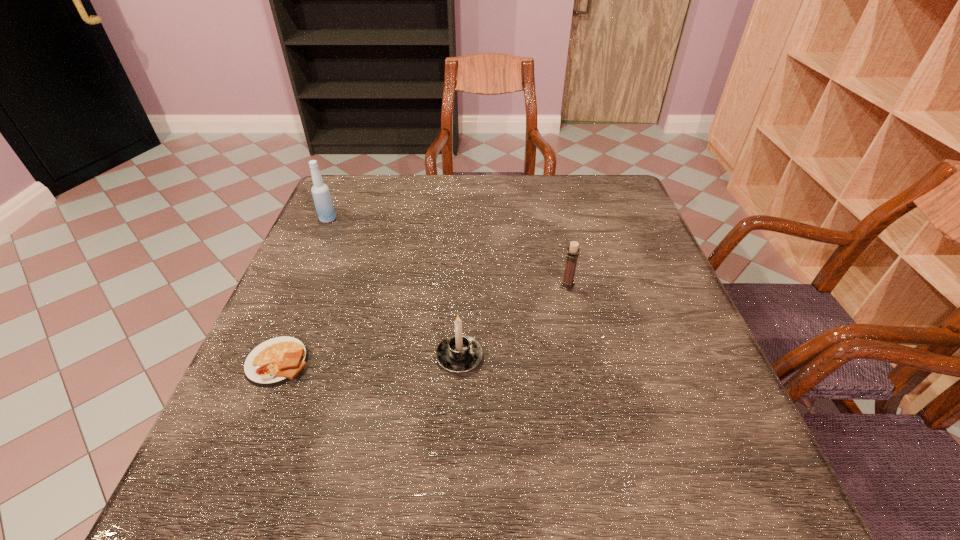
Where is `blank space at the right edge of the desktop`? The image size is (960, 540). blank space at the right edge of the desktop is located at coordinates pyautogui.click(x=678, y=297).

I want to click on vacant space at the near left corner, so click(277, 472).

Identify the location of free region at the far right corner of the desktop. (618, 176).

Find the location of a particular element. free spot between the right candle holder and the bottle is located at coordinates pyautogui.click(x=447, y=253).

Identify the location of free spot between the third object from left to right and the tallest object. This screenshot has height=540, width=960. (394, 288).

Where is `unoccupied position between the bottle and the third object from left to right`? This screenshot has height=540, width=960. unoccupied position between the bottle and the third object from left to right is located at coordinates 394,288.

I want to click on vacant area that lies between the omelet and the left candle holder, so click(369, 359).

Identify the location of vacant space that is in between the omelet and the left candle holder. The height and width of the screenshot is (540, 960). (x=369, y=359).

Identify the location of vacant space that is in between the second object from right to left and the tallest object. The image size is (960, 540). (394, 288).

I want to click on vacant region between the omelet and the tallest object, so click(x=303, y=291).